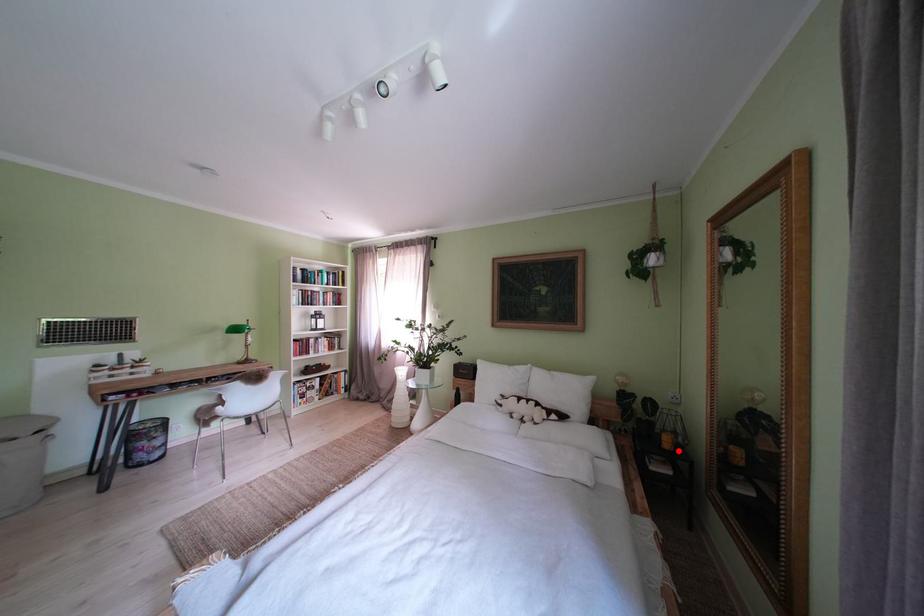
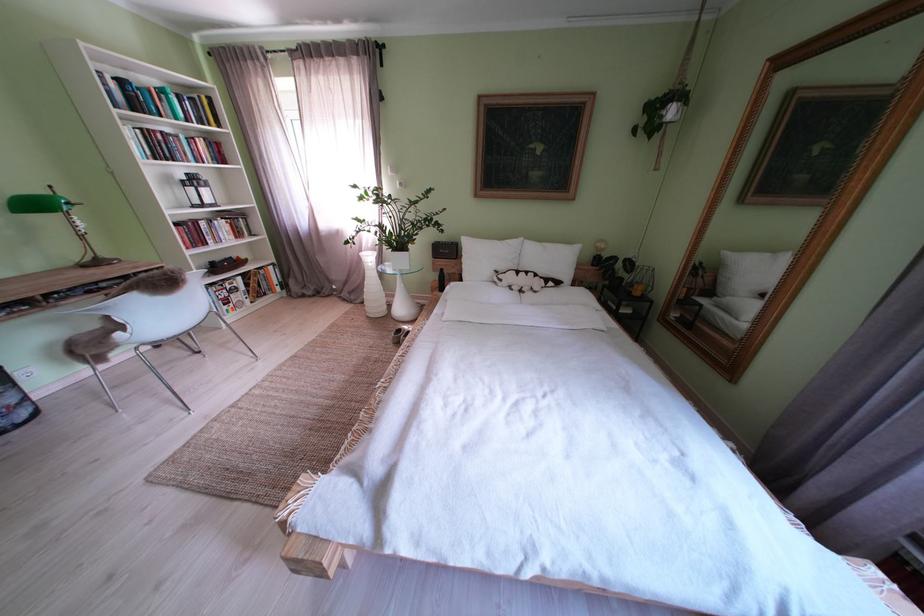
Question: A red point is marked in image1. In image2, is the corresponding 3D point closer to the camera or farther? Reply with the corresponding letter.

Choices:
 (A) The corresponding 3D point is closer.
 (B) The corresponding 3D point is farther.

Answer: (A)